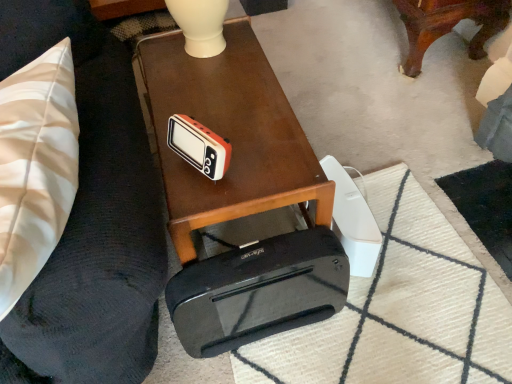
This screenshot has width=512, height=384. I want to click on vacant area situated below black plastic cassette at lower center (from a real-world perspective), so click(268, 318).